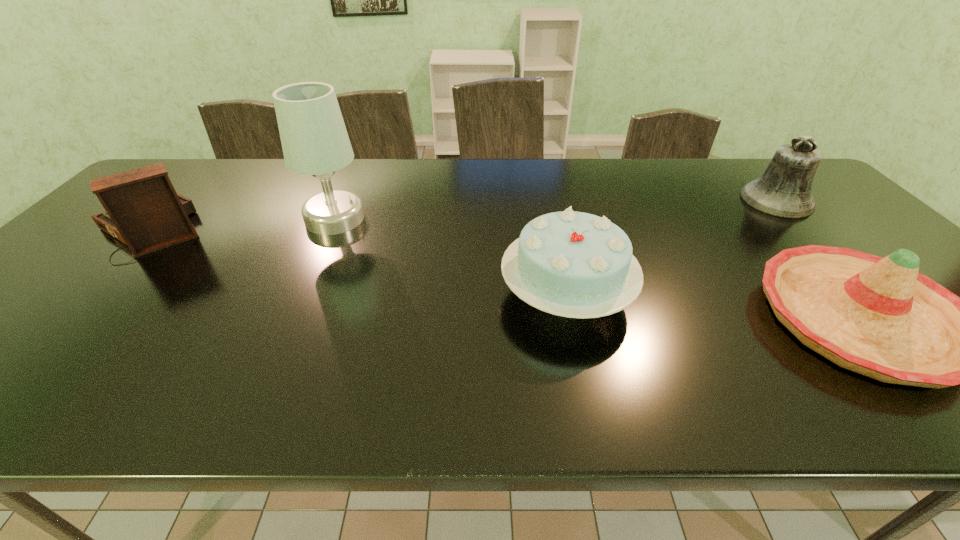
Where is `the second object from left to right`? the second object from left to right is located at coordinates (314, 139).

I want to click on the tallest object, so click(x=314, y=139).

The width and height of the screenshot is (960, 540). Identify the location of bell. (784, 189).

In order to click on phonograph record in this screenshot , I will do `click(143, 210)`.

I want to click on the third object from left to right, so click(x=572, y=264).

Where is `vacant area located 0.240m on the base of the lampshade`? The width and height of the screenshot is (960, 540). vacant area located 0.240m on the base of the lampshade is located at coordinates (300, 295).

Where is `vacant position located 0.100m on the left of the bell`? This screenshot has height=540, width=960. vacant position located 0.100m on the left of the bell is located at coordinates (710, 200).

Where is `vacant area situated 0.130m on the right of the leftmost object`? The width and height of the screenshot is (960, 540). vacant area situated 0.130m on the right of the leftmost object is located at coordinates (252, 228).

Locate an element on the screen. This screenshot has width=960, height=540. vacant area situated 0.310m on the left of the third object from right to left is located at coordinates (370, 294).

Where is `object that is at the far edge`? object that is at the far edge is located at coordinates (784, 189).